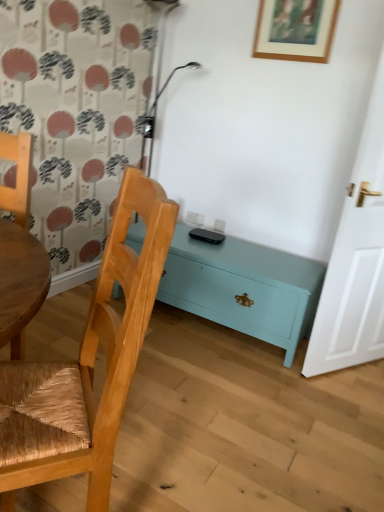
Identify the location of blank space above teal painted wood chest at lower center (from a real-world perspective). pyautogui.click(x=251, y=255).